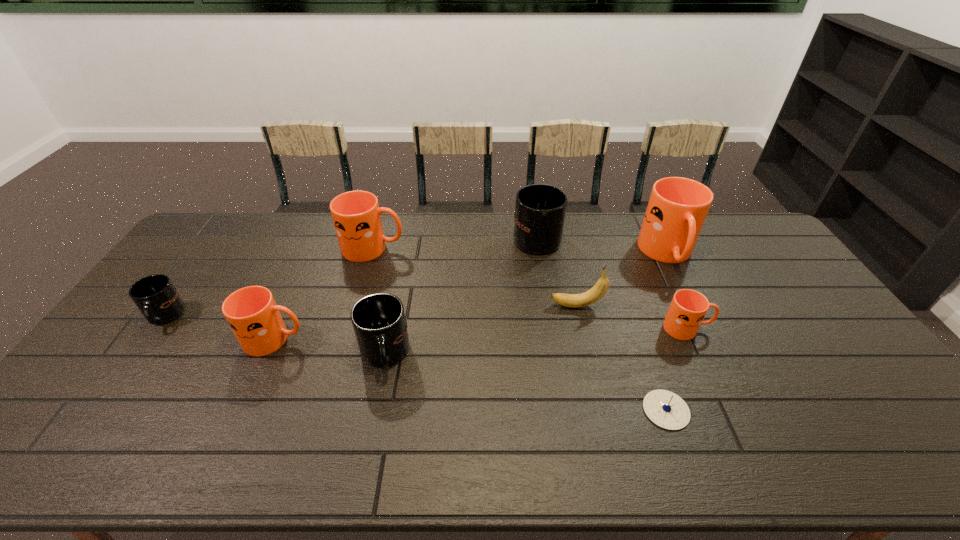
The width and height of the screenshot is (960, 540). I want to click on vacant region located 0.070m with the handle on the side of the second black mug from left to right, so click(x=374, y=406).

Find the location of `vacant space located on the handle side of the smallest orange mug`. vacant space located on the handle side of the smallest orange mug is located at coordinates (744, 328).

The image size is (960, 540). What are the coordinates of `free space located 0.090m with the handle on the side of the leftmost black mug` in the screenshot? It's located at (133, 360).

This screenshot has width=960, height=540. I want to click on vacant space situated on the back of the blue compass, so click(636, 323).

Where is `object present at the left edge`? object present at the left edge is located at coordinates (155, 296).

Locate an element on the screen. The width and height of the screenshot is (960, 540). free spot at the far edge of the desktop is located at coordinates (270, 248).

You are a GUI agent. You are given a task and a screenshot of the screen. Output one action in this format:
    pyautogui.click(x=<x>, y=<y>)
    Task: Click on the vacant region at the near edge of the desktop
    
    Given the screenshot: What is the action you would take?
    pyautogui.click(x=387, y=434)

This screenshot has height=540, width=960. In the image, there is a desktop. What are the coordinates of `vacant space at the left edge` in the screenshot? It's located at point(113,383).

I want to click on free space at the right edge of the desktop, so click(x=773, y=269).

This screenshot has width=960, height=540. In the image, there is a desktop. Find the location of `free space at the far left corner`. free space at the far left corner is located at coordinates (219, 228).